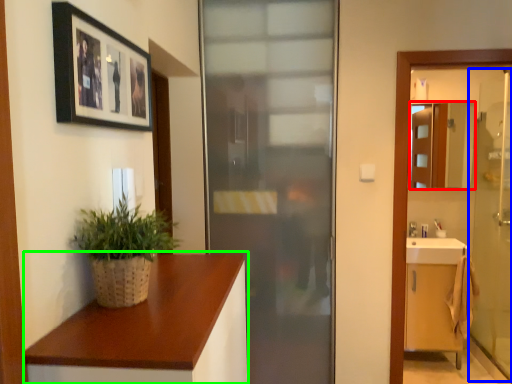
Question: Considering the real-world distances, which object is farthest from mirror (highlighted by a red box)? screen door (highlighted by a blue box) or countertop (highlighted by a green box)?

Choices:
 (A) screen door
 (B) countertop

Answer: (B)